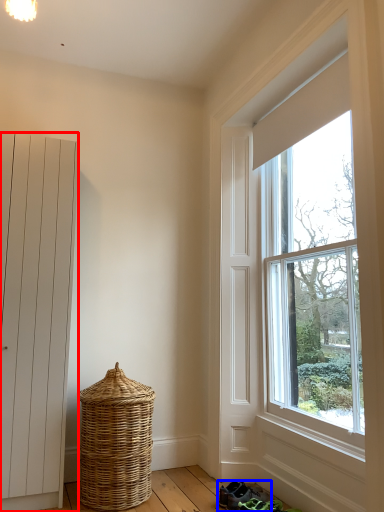
Question: Which of the following is the closest to the observer, door (highlighted by a red box) or footwear (highlighted by a blue box)?

Choices:
 (A) door
 (B) footwear

Answer: (A)